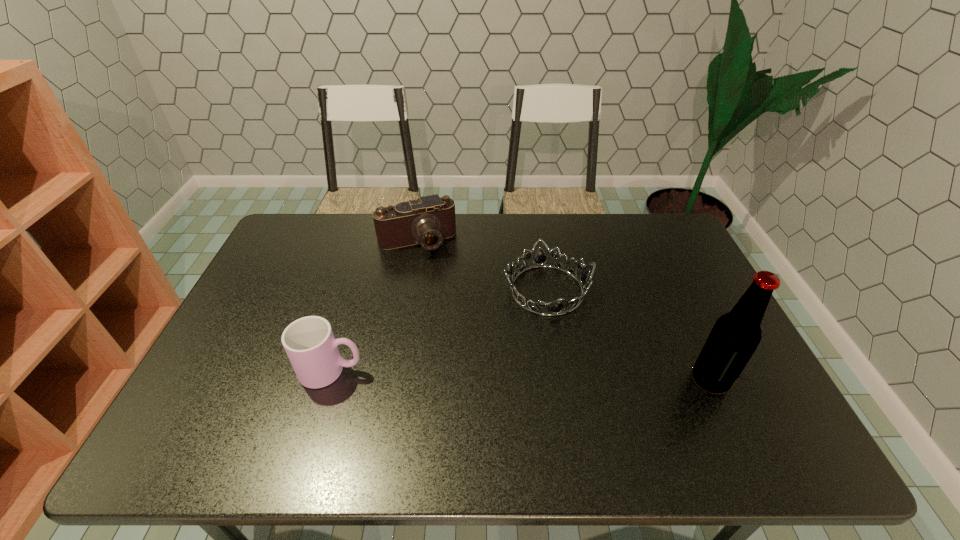
I want to click on cup, so click(309, 342).

The image size is (960, 540). Identify the location of the tallest object. (735, 336).

Where is `beer bottle`? The image size is (960, 540). beer bottle is located at coordinates (735, 336).

This screenshot has width=960, height=540. What are the coordinates of `tiara` in the screenshot? It's located at (540, 260).

I want to click on the shortest object, so click(540, 260).

The height and width of the screenshot is (540, 960). I want to click on camera, so click(x=428, y=220).

Where is `vacant space located with the handle on the side of the cup`? Image resolution: width=960 pixels, height=540 pixels. vacant space located with the handle on the side of the cup is located at coordinates (388, 370).

At what (x,y) coordinates should I click in order to perform the action: click on vacant space located on the front of the rightmost object. Please return your answer as a coordinate pair (x, y). The height and width of the screenshot is (540, 960). Looking at the image, I should click on (727, 416).

Find the location of a particular element. free spot located on the front-facing side of the second object from right to left is located at coordinates (588, 416).

Locate an element on the screen. vacant space located 0.080m on the front-facing side of the second object from right to left is located at coordinates (565, 346).